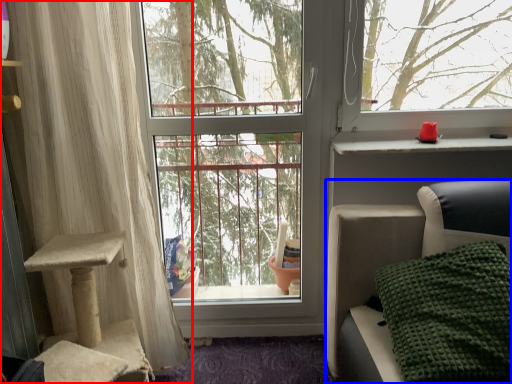
Question: Among these objects, which one is nearest to the camera, curtain (highlighted by a red box) or furniture (highlighted by a blue box)?

Choices:
 (A) curtain
 (B) furniture

Answer: (B)